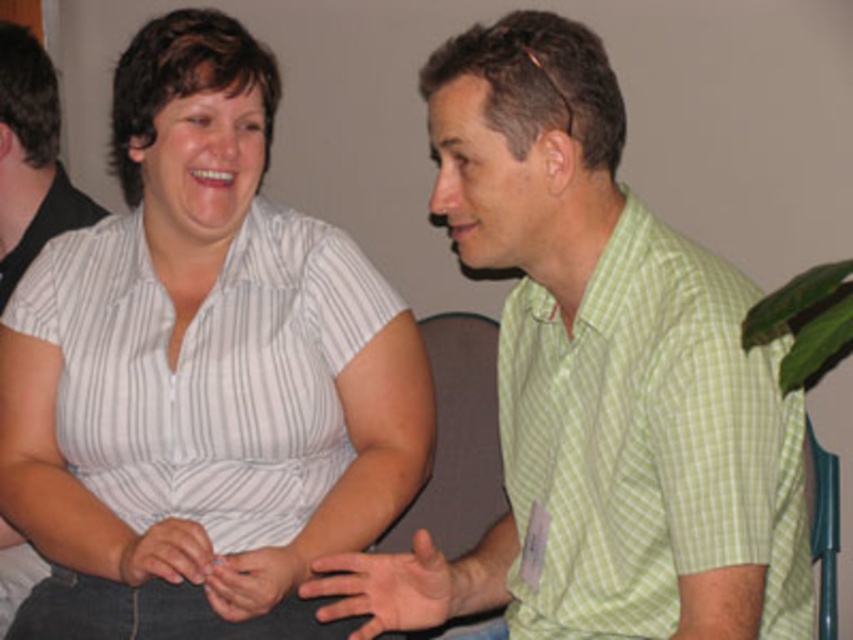
Who is shorter, white striped shirt at center or black shirt at left?

Standing shorter between the two is black shirt at left.

Who is more distant from viewer, (144, 428) or (13, 278)?

The point (13, 278) is more distant.

The image size is (853, 640). I want to click on white striped shirt at center, so click(x=206, y=353).

Which is above, green checkered shirt at center or white striped shirt at center?

white striped shirt at center is higher up.

Is green checkered shirt at center below white striped shirt at center?

Yes, green checkered shirt at center is below white striped shirt at center.

Who is more forward, (722, 627) or (199, 406)?

Point (722, 627) is in front.

I want to click on green checkered shirt at center, so click(596, 381).

Looking at this image, is white striped shirt at center further to camera compared to green checkered shirt at right?

Yes.

Is point (415, 488) closer to camera compared to point (711, 419)?

No, (415, 488) is further to viewer.

Locate an element on the screen. Image resolution: width=853 pixels, height=640 pixels. white striped shirt at center is located at coordinates (x=206, y=353).